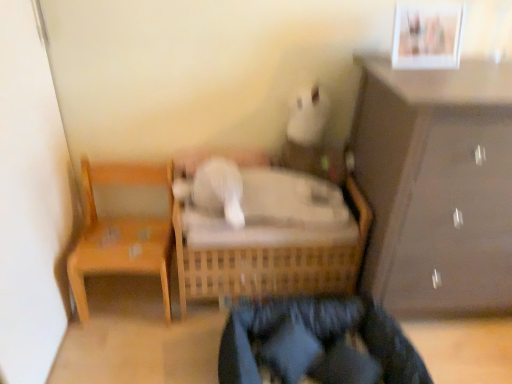
Locate an element on the screen. The width and height of the screenshot is (512, 384). free space in front of wooden chair at left is located at coordinates (121, 349).